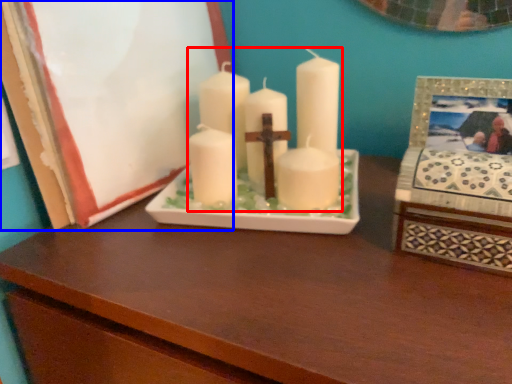
Question: Which of the following is the closest to the observer, candle (highlighted by a red box) or picture frame (highlighted by a blue box)?

Choices:
 (A) candle
 (B) picture frame

Answer: (B)